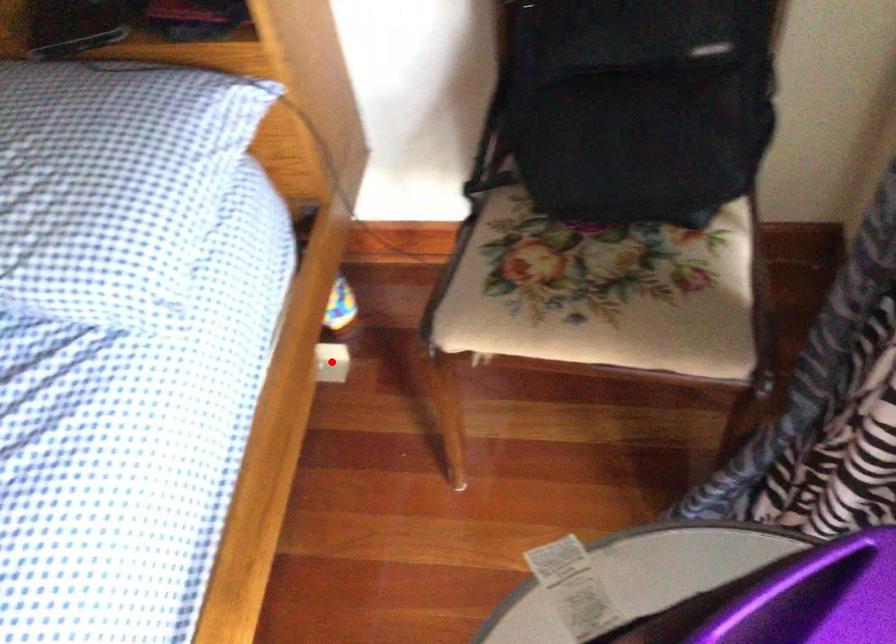
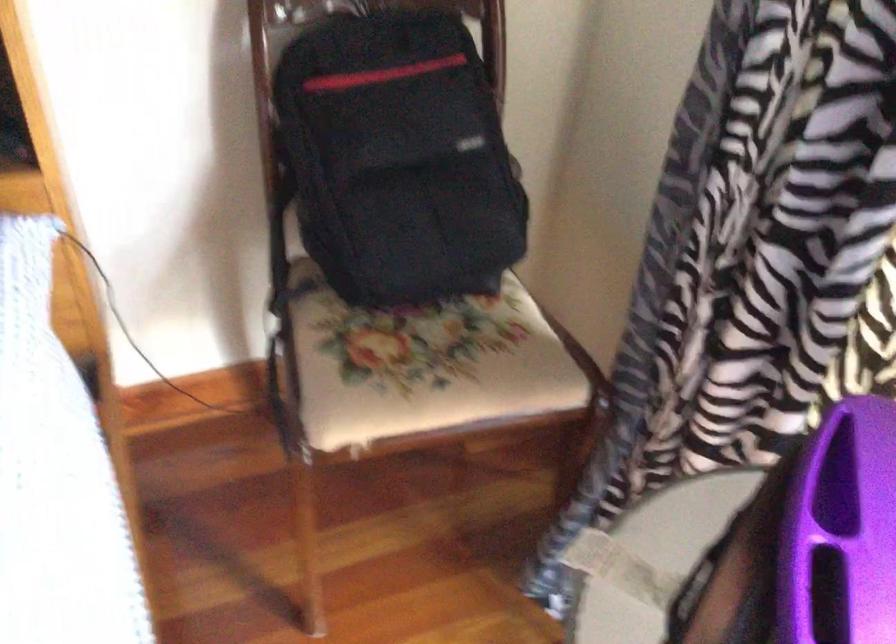
Question: I am providing you with two images of the same scene from different viewpoints. A red point is marked on the first image. At the location where the point appears in image 1, is it still visible in image 2?

Choices:
 (A) Yes
 (B) No

Answer: (B)